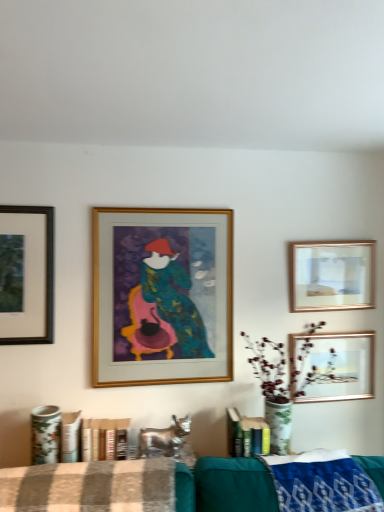
Question: Is blue woven blanket at lower right situated inside matte black frame at upper left, which is the 1th picture frame in left-to-right order, or outside?

Choices:
 (A) outside
 (B) inside

Answer: (A)

Question: Based on their sizes in the image, would you say blue woven blanket at lower right is bigger or smaller than matte black frame at upper left, placed as the 4th picture frame when sorted from right to left?

Choices:
 (A) big
 (B) small

Answer: (A)

Question: Considering the real-world distances, which object is closest to the gold metallic picture frame at center, which is the third picture frame from right to left?

Choices:
 (A) blue woven blanket at lower right
 (B) matte black frame at upper left, which is the 1th picture frame in left-to-right order
 (C) gold-framed picture at upper right, the third picture frame from the left
 (D) metallic gold picture frame at upper right, placed as the 4th picture frame when sorted from left to right
 (E) brown checkered fabric at lower center

Answer: (B)

Question: Which object is positioned farthest from the gold metallic picture frame at center, which ranks as the second picture frame in left-to-right order?

Choices:
 (A) blue woven blanket at lower right
 (B) metallic gold picture frame at upper right, placed as the 4th picture frame when sorted from left to right
 (C) gold-framed picture at upper right, the second picture frame when ordered from right to left
 (D) brown checkered fabric at lower center
 (E) matte black frame at upper left, placed as the 4th picture frame when sorted from right to left

Answer: (A)